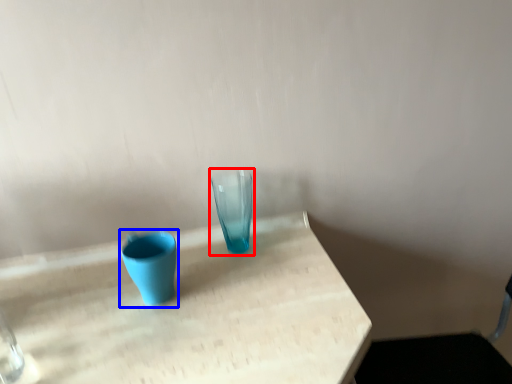
Question: Which object appears closest to the camera in this image, vase (highlighted by a red box) or vase (highlighted by a blue box)?

Choices:
 (A) vase
 (B) vase

Answer: (B)